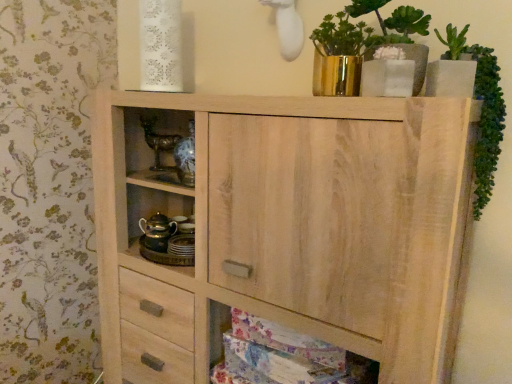
What is the approximate height of green leafy plant at upper right?

green leafy plant at upper right is 14.64 inches tall.

Image resolution: width=512 pixels, height=384 pixels. What do you see at coordinates (481, 111) in the screenshot?
I see `green leafy plant at upper right` at bounding box center [481, 111].

You are a GUI agent. You are given a task and a screenshot of the screen. Output one action in this format:
    pyautogui.click(x=<x>, y=<y>)
    Task: Click on the gold reflective vase at upper center
    
    Given the screenshot: What is the action you would take?
    pyautogui.click(x=336, y=74)

From the image's perspective, which is above, gold reflective vase at upper center or natural wood cabinet at center?

gold reflective vase at upper center appears higher in the image.

Is gold reflective vase at upper center touching natural wood cabinet at center?

No, gold reflective vase at upper center is not making contact with natural wood cabinet at center.

Can you tell me how much gold reflective vase at upper center and natural wood cabinet at center differ in facing direction?

1.11 degrees separate the facing orientations of gold reflective vase at upper center and natural wood cabinet at center.

Would you say natural wood cabinet at center is part of gold reflective vase at upper center's contents?

That's incorrect, natural wood cabinet at center is not inside gold reflective vase at upper center.

From the image's perspective, which is below, gold metallic teapot at center left or natural wood cabinet at center?

natural wood cabinet at center is shown below in the image.

Based on their positions, is gold metallic teapot at center left located to the left or right of natural wood cabinet at center?

From the image, it's evident that gold metallic teapot at center left is to the left of natural wood cabinet at center.

Locate an element on the screen. The height and width of the screenshot is (384, 512). tea set above the natural wood cabinet at center (from a real-world perspective) is located at coordinates (157, 232).

Between gold metallic teapot at center left and natural wood cabinet at center, which one has larger size?

natural wood cabinet at center.

Is green leafy plant at upper right next to gold reflective vase at upper center?

No, green leafy plant at upper right is not beside gold reflective vase at upper center.

Is green leafy plant at upper right located outside gold reflective vase at upper center?

Yes.

Considering the sizes of objects green leafy plant at upper right and gold reflective vase at upper center in the image provided, who is bigger, green leafy plant at upper right or gold reflective vase at upper center?

With larger size is green leafy plant at upper right.

Which of these two, gold reflective vase at upper center or natural wood cabinet at lower center, is wider?

With larger width is natural wood cabinet at lower center.

Based on the photo, choose the correct answer: Is gold reflective vase at upper center inside natural wood cabinet at lower center or outside it?

gold reflective vase at upper center is spatially situated outside natural wood cabinet at lower center.

From the picture: Considering the relative sizes of gold reflective vase at upper center and natural wood cabinet at lower center in the image provided, is gold reflective vase at upper center shorter than natural wood cabinet at lower center?

In fact, gold reflective vase at upper center may be taller than natural wood cabinet at lower center.

Is gold reflective vase at upper center next to natural wood cabinet at lower center and touching it?

There is a gap between gold reflective vase at upper center and natural wood cabinet at lower center.

How many degrees apart are the facing directions of gold reflective vase at upper center and green leafy plant at upper right?

The facing directions of gold reflective vase at upper center and green leafy plant at upper right are 0.000451 degrees apart.

Where is `plant below the gold reflective vase at upper center (from the image's perspective)`? The width and height of the screenshot is (512, 384). plant below the gold reflective vase at upper center (from the image's perspective) is located at coordinates (481, 111).

Measure the distance from gold reflective vase at upper center to green leafy plant at upper right.

They are 25.83 centimeters apart.

From a real-world perspective, is gold reflective vase at upper center above or below green leafy plant at upper right?

Clearly, from a real-world perspective, gold reflective vase at upper center is above green leafy plant at upper right.

Considering the sizes of objects green leafy plant at upper right and natural wood cabinet at center in the image provided, who is shorter, green leafy plant at upper right or natural wood cabinet at center?

green leafy plant at upper right.

Which is behind, green leafy plant at upper right or natural wood cabinet at center?

green leafy plant at upper right is further away from the camera.

Would you consider green leafy plant at upper right to be distant from natural wood cabinet at center?

No.

Is green leafy plant at upper right wider than natural wood cabinet at center?

No, green leafy plant at upper right is not wider than natural wood cabinet at center.

Is gold metallic teapot at center left with gold reflective vase at upper center?

There is a gap between gold metallic teapot at center left and gold reflective vase at upper center.

Which is behind, gold metallic teapot at center left or gold reflective vase at upper center?

gold metallic teapot at center left is more distant.

In the scene shown: Which is correct: gold metallic teapot at center left is inside gold reflective vase at upper center, or outside of it?

gold metallic teapot at center left is spatially situated outside gold reflective vase at upper center.

Find the location of a particular element. This screenshot has width=512, height=384. the chest of drawers lying below the gold reflective vase at upper center (from the image's perspective) is located at coordinates (288, 229).

Identify the location of chest of drawers in front of the gold metallic teapot at center left. (288, 229).

Considering their positions, is natural wood cabinet at center positioned further to green leafy plant at upper right than natural wood cabinet at lower center?

natural wood cabinet at lower center.

When comparing their distances from green leafy plant at upper right, does gold metallic teapot at center left or natural wood cabinet at center seem closer?

natural wood cabinet at center.

Looking at the image, which one is located closer to green leafy plant at upper right, gold reflective vase at upper center or natural wood cabinet at center?

Among the two, gold reflective vase at upper center is located nearer to green leafy plant at upper right.

Estimate the real-world distances between objects in this image. Which object is further from natural wood cabinet at center, gold reflective vase at upper center or gold metallic teapot at center left?

gold reflective vase at upper center.

When comparing their distances from green leafy plant at upper right, does natural wood cabinet at lower center or gold reflective vase at upper center seem further?

natural wood cabinet at lower center is further to green leafy plant at upper right.

Considering their positions, is natural wood cabinet at center positioned further to natural wood cabinet at lower center than green leafy plant at upper right?

green leafy plant at upper right is further to natural wood cabinet at lower center.

From the image, which object appears to be farther from gold metallic teapot at center left, natural wood cabinet at lower center or gold reflective vase at upper center?

Based on the image, gold reflective vase at upper center appears to be further to gold metallic teapot at center left.

Looking at the image, which one is located further to gold reflective vase at upper center, gold metallic teapot at center left or green leafy plant at upper right?

gold metallic teapot at center left.

Image resolution: width=512 pixels, height=384 pixels. What are the coordinates of `glass vase between gold metallic teapot at center left and green leafy plant at upper right` in the screenshot? It's located at (336, 74).

Locate an element on the screen. This screenshot has width=512, height=384. plant that lies between gold reflective vase at upper center and natural wood cabinet at lower center from top to bottom is located at coordinates (481, 111).

The height and width of the screenshot is (384, 512). Identify the location of cabinet between natural wood cabinet at center and gold metallic teapot at center left from front to back. (300, 345).

The image size is (512, 384). Identify the location of plant between gold reflective vase at upper center and natural wood cabinet at center vertically. (481, 111).